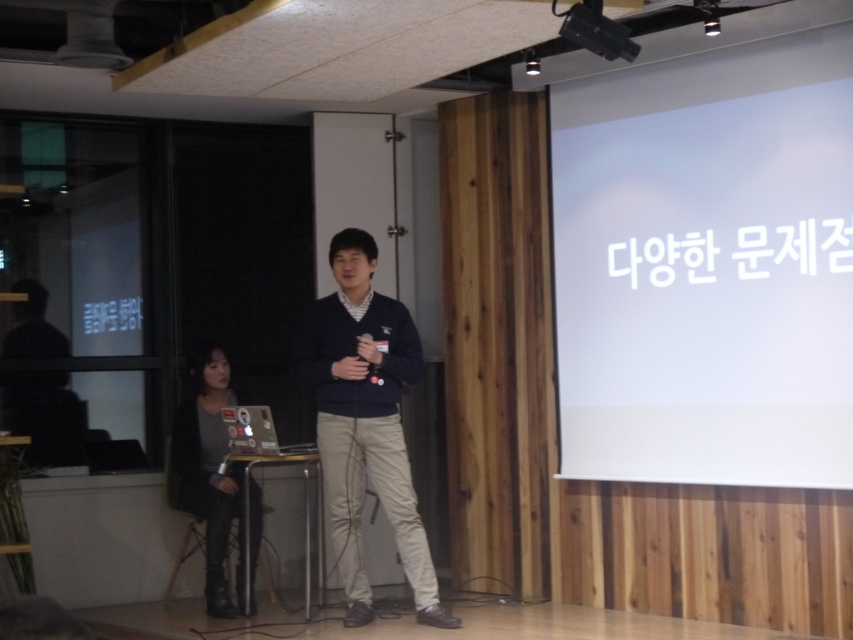
Question: Can you confirm if navy blue sweater at center is positioned above gray fabric jacket at lower left?

Choices:
 (A) yes
 (B) no

Answer: (A)

Question: Is white matte projection screen at upper right wider than navy blue sweater at center?

Choices:
 (A) no
 (B) yes

Answer: (B)

Question: Estimate the real-world distances between objects in this image. Which object is farther from the gray fabric jacket at lower left?

Choices:
 (A) navy blue sweater at center
 (B) black plastic projector at upper center
 (C) white matte projection screen at upper right

Answer: (B)

Question: Which of the following is the farthest from the observer?

Choices:
 (A) black plastic projector at upper center
 (B) white matte projection screen at upper right
 (C) gray fabric jacket at lower left
 (D) navy blue sweater at center

Answer: (C)

Question: Is gray fabric jacket at lower left bigger than black plastic projector at upper center?

Choices:
 (A) yes
 (B) no

Answer: (A)

Question: Which of the following is the farthest from the observer?

Choices:
 (A) white matte projection screen at upper right
 (B) black plastic projector at upper center

Answer: (A)